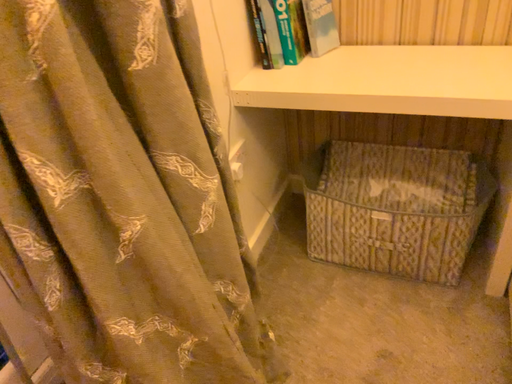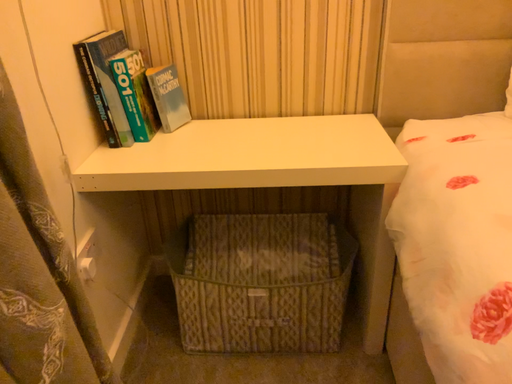
Question: Which way did the camera rotate in the video?

Choices:
 (A) rotated right
 (B) rotated left

Answer: (A)